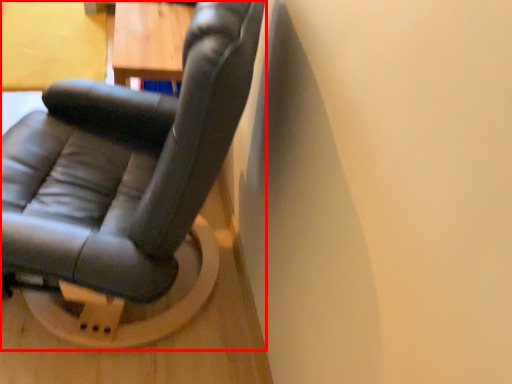
Question: In this image, where is chair (annotated by the red box) located relative to table?

Choices:
 (A) left
 (B) right

Answer: (A)